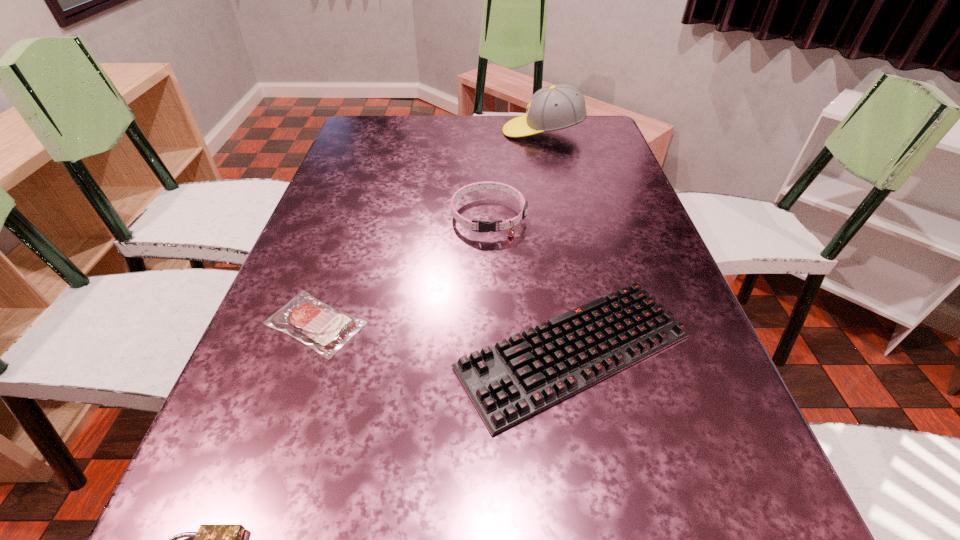
Where is `the fourth closest object to the nearest object`? the fourth closest object to the nearest object is located at coordinates point(559,106).

The image size is (960, 540). What are the coordinates of `blank area in the image that satisfies the following two spatial constraints: 1. on the front side of the steak; 2. on the right side of the computer keyboard` in the screenshot? It's located at (305, 352).

The image size is (960, 540). In order to click on vacant region that satisfies the following two spatial constraints: 1. on the front-facing side of the tallest object; 2. with the buckle on the dog collar in this screenshot , I will do `click(562, 216)`.

The height and width of the screenshot is (540, 960). I want to click on vacant region that satisfies the following two spatial constraints: 1. with the buckle on the third tallest object; 2. on the left side of the dog collar, so click(x=492, y=352).

The image size is (960, 540). I want to click on free spot that satisfies the following two spatial constraints: 1. on the front side of the steak; 2. on the left side of the computer keyboard, so click(x=305, y=352).